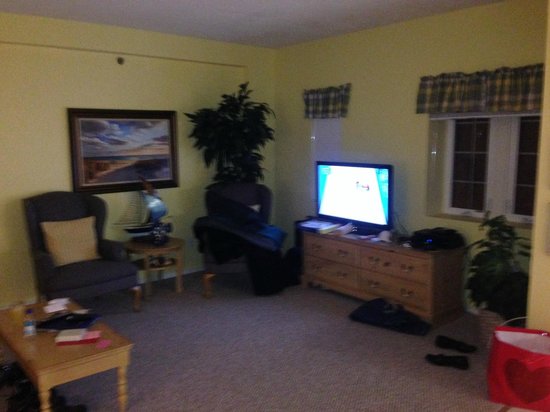
Locate an element on the screen. The width and height of the screenshot is (550, 412). chairs is located at coordinates pyautogui.click(x=102, y=276), pyautogui.click(x=216, y=265).